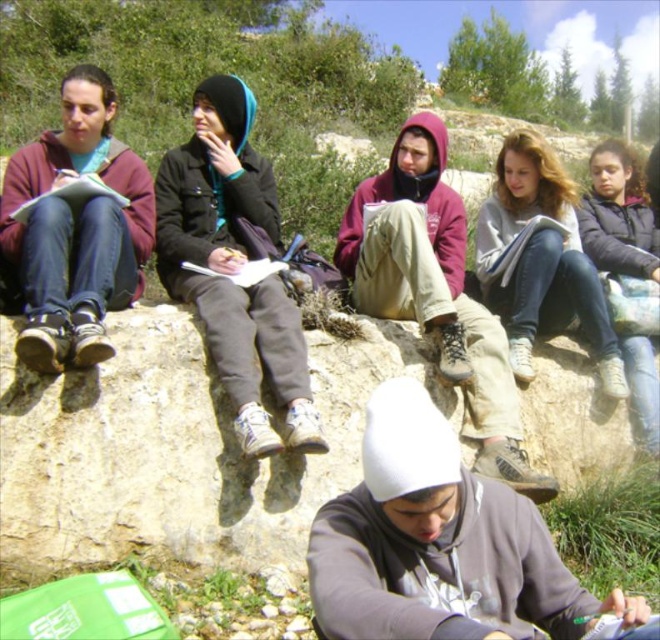
You are standing at the origin point of the coordinate system in the image. The image has a coordinate system where the bottom left corner is the origin. You want to move towards the matte black shoes at left. Which direction should you move?

Since the matte black shoes at left are located at coordinate point (77, 227), you should move towards the right and upwards from the origin point to reach them.

Consider the image. You are a hiker trying to place your dark gray hoodie at upper right on the brown rough rock at center. Based on the scene, will the rock be able to support the hoodie without it falling off?

The brown rough rock at center is smaller than the dark gray hoodie at upper right, so placing the hoodie on the rock may cause it to fall off since the rock is not large enough to provide stable support.

You are a person who needs to reach the dark gray hoodie at upper right from the brown rough rock at center. How many steps would you need to take if each step covers approximately 2.5 feet?

The distance between the brown rough rock at center and the dark gray hoodie at upper right is 19.36 feet. Dividing this by 2.5 feet per step gives approximately 7.74 steps. Since you can only take whole steps, you would need to take 8 steps to reach the dark gray hoodie at upper right from the brown rough rock at center.